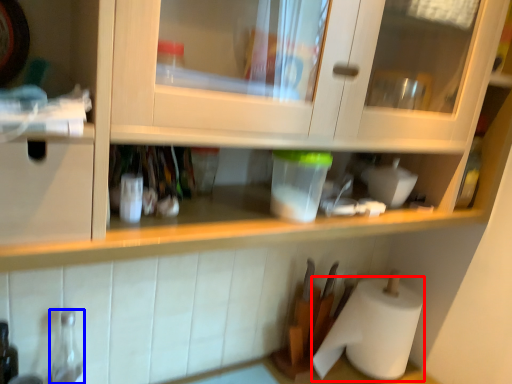
Question: Which point is further to the camera, paper towel (highlighted by a red box) or bottle (highlighted by a blue box)?

Choices:
 (A) paper towel
 (B) bottle

Answer: (A)